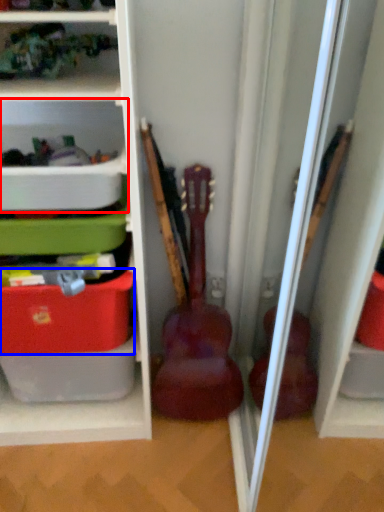
Question: Which object appears closest to the camera in this image, shelf (highlighted by a red box) or storage box (highlighted by a blue box)?

Choices:
 (A) shelf
 (B) storage box

Answer: (A)